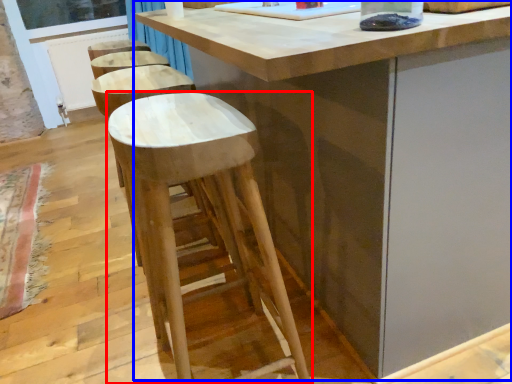
Question: Which of the following is the farthest to the observer, stool (highlighted by a red box) or table (highlighted by a blue box)?

Choices:
 (A) stool
 (B) table

Answer: (B)